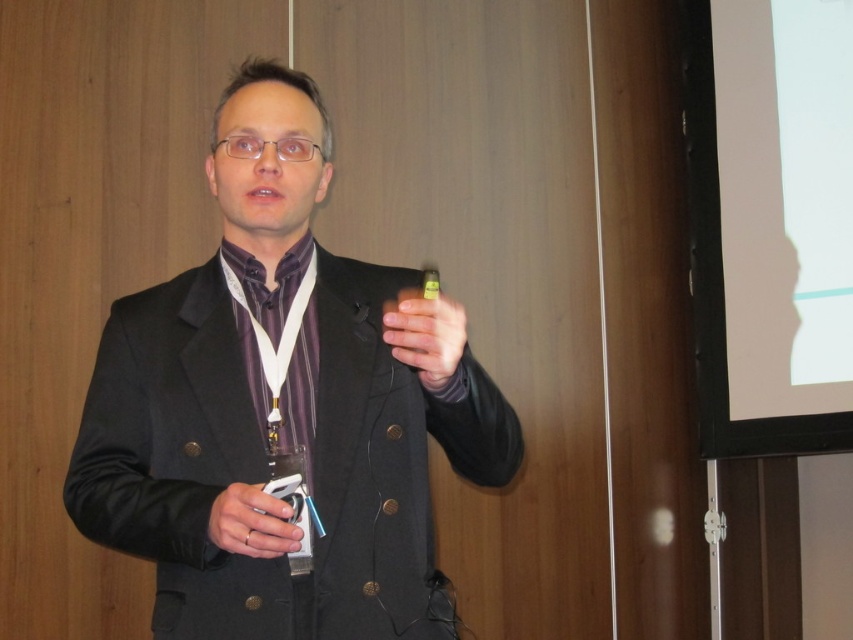
Who is more forward, (212, 177) or (257, 502)?

Point (257, 502) is more forward.

Looking at this image, measure the distance from black matte suit at center to matte black remote at lower left.

A distance of 10.48 inches exists between black matte suit at center and matte black remote at lower left.

Identify the location of black matte suit at center. The height and width of the screenshot is (640, 853). (277, 406).

I want to click on black matte suit at center, so click(x=277, y=406).

Does matte black pen at center have a greater width compared to matte black remote at lower left?

Indeed, matte black pen at center has a greater width compared to matte black remote at lower left.

Who is positioned more to the right, matte black pen at center or matte black remote at lower left?

Positioned to the right is matte black pen at center.

Does point (415, 296) come behind point (285, 518)?

That is True.

Where is `matte black pen at center`? matte black pen at center is located at coordinates (425, 333).

Between black matte suit at center and matte black pen at center, which one is positioned lower?

black matte suit at center is below.

Which is more to the right, black matte suit at center or matte black pen at center?

Positioned to the right is matte black pen at center.

Between point (320, 266) and point (463, 340), which one is positioned behind?

The point (320, 266) is behind.

This screenshot has height=640, width=853. Identify the location of black matte suit at center. (277, 406).